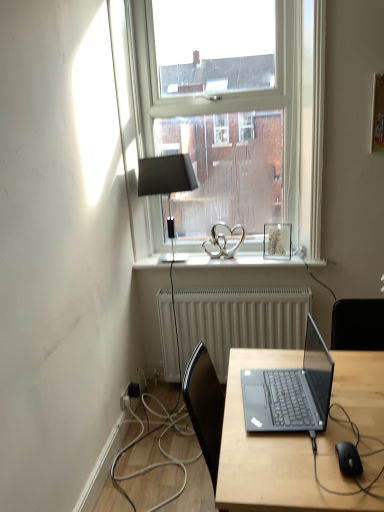
Question: Looking at their shapes, would you say matte black laptop at center is wider or thinner than matte silver picture frame at upper right?

Choices:
 (A) thin
 (B) wide

Answer: (B)

Question: Looking at the image, does matte black laptop at center seem bigger or smaller compared to matte silver picture frame at upper right?

Choices:
 (A) big
 (B) small

Answer: (A)

Question: Estimate the real-world distances between objects in this image. Which object is farther from the white glossy window sill at center?

Choices:
 (A) matte black laptop at center
 (B) matte silver picture frame at upper right
 (C) black rubber cable at lower right
 (D) white textured radiator at center
 (E) clear glass window at upper center

Answer: (C)

Question: Which object is the farthest from the black rubber cable at lower right?

Choices:
 (A) white textured radiator at center
 (B) black matte computer mouse at lower right
 (C) matte black laptop at center
 (D) white glossy window sill at center
 (E) clear glass window at upper center

Answer: (E)